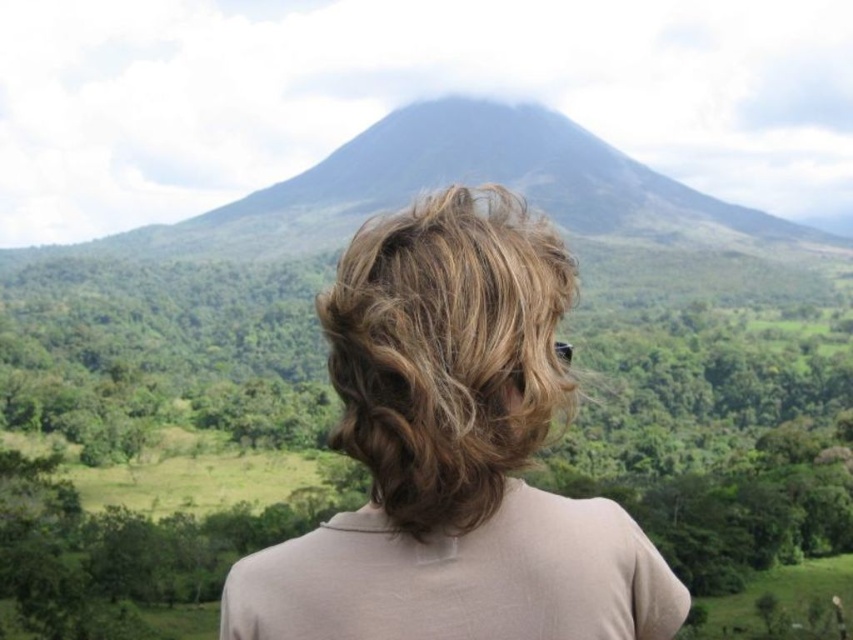
You are a photographer trying to capture the volcano in the background. You notice a point at coordinates point [453,452]. What object is located at that point?

The point [453,452] is where the blonde hair at center is located.

You are a photographer trying to capture the person in the scene. You notice two strands of hair on the person, one labeled as blonde hair at center and the other as blonde curly hair at center. Which hair strand is closer to the camera?

The distance between the blonde hair at center and the blonde curly hair at center is 1.35 meters, so whichever is closer cannot be determined without additional information about their positions relative to the camera.

Based on the photo, you are a photographer trying to capture the person in the scene. Which part of the person is positioned lower between the blonde hair at center and the blonde curly hair at center?

The blonde hair at center is positioned lower than the blonde curly hair at center.